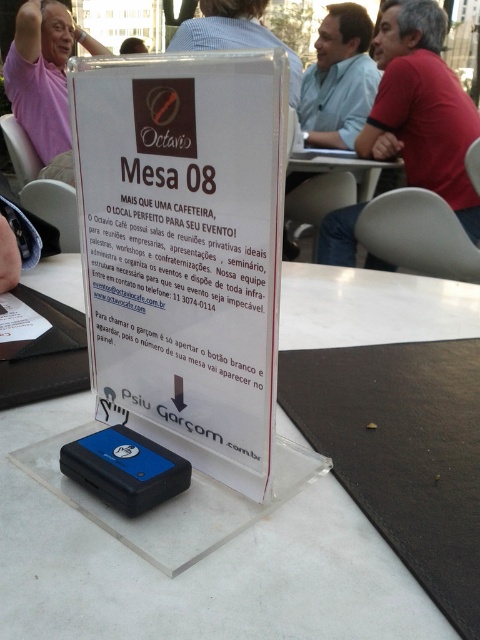
Is clear plastic sign at center above black plastic remote at center?

Correct, clear plastic sign at center is located above black plastic remote at center.

Is point (186, 321) positioned in front of point (162, 465)?

That is False.

At what (x,y) coordinates should I click in order to perform the action: click on clear plastic sign at center. Please return your answer as a coordinate pair (x, y). This screenshot has width=480, height=640. Looking at the image, I should click on (184, 248).

How much distance is there between transparent plastic sign at center and black plastic remote at center?

transparent plastic sign at center and black plastic remote at center are 9.25 inches apart.

Does transparent plastic sign at center have a greater width compared to black plastic remote at center?

Yes.

At what (x,y) coordinates should I click in order to perform the action: click on transparent plastic sign at center. Please return your answer as a coordinate pair (x, y). Image resolution: width=480 pixels, height=640 pixels. Looking at the image, I should click on (195, 566).

Where is `transparent plastic sign at center`? transparent plastic sign at center is located at coordinates (195, 566).

Which is behind, point (371, 600) or point (372, 60)?

The point (372, 60) is behind.

Is point (224, 561) in front of point (319, 144)?

Yes, it is.

Between point (324, 280) and point (359, 13), which one is positioned behind?

The point (359, 13) is behind.

Where is `transparent plastic sign at center`? This screenshot has height=640, width=480. transparent plastic sign at center is located at coordinates (195, 566).